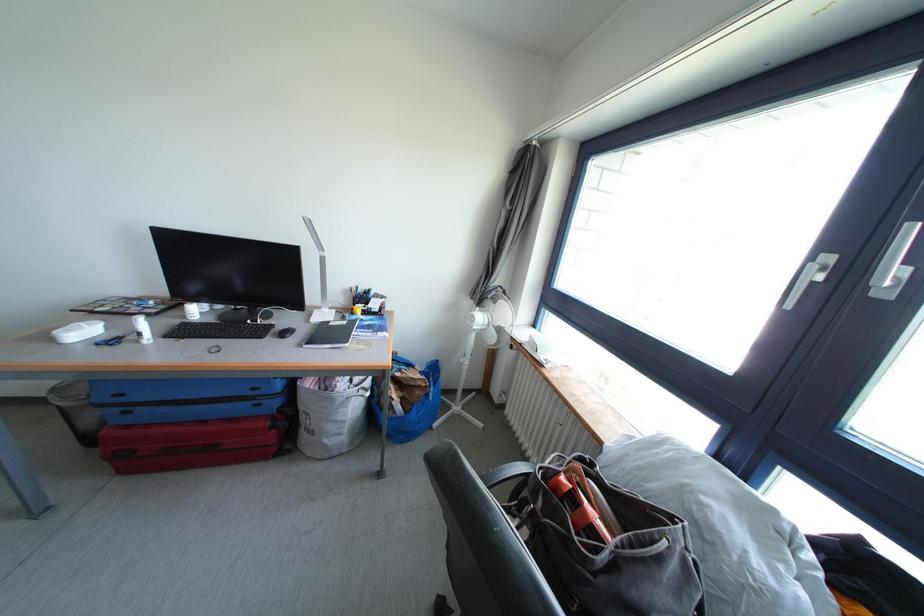
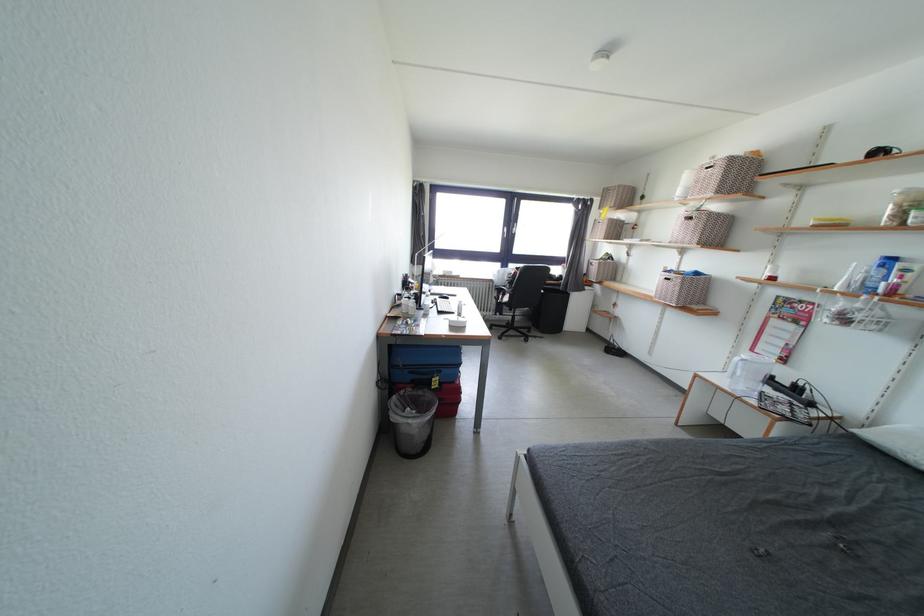
Question: I am providing you with two images of the same scene from different viewpoints. After the viewpoint changes to image2, which objects are now occluded?

Choices:
 (A) chair sitting surface
 (B) red suitcase handle
 (C) brown stuffed animal
 (D) white pillow

Answer: (B)